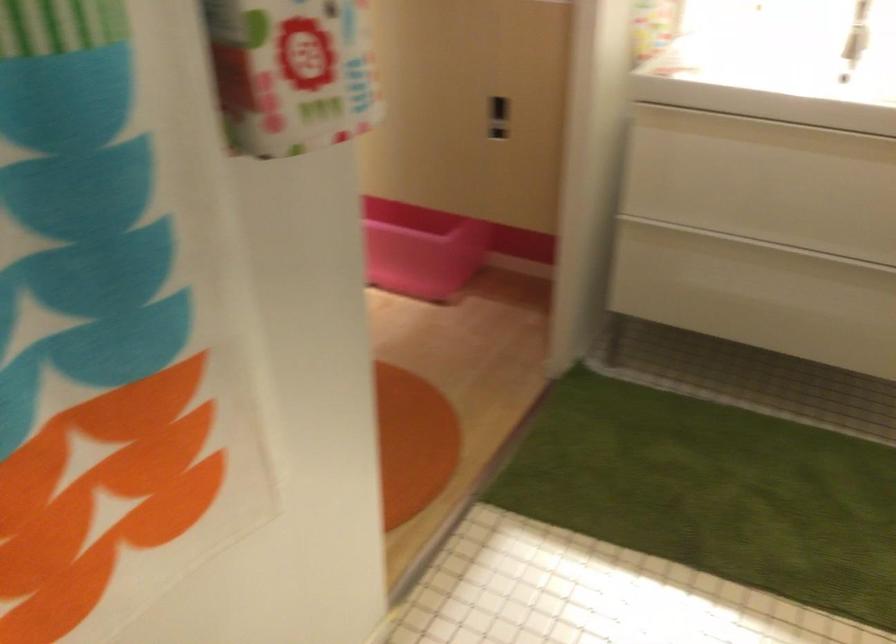
The location [420,249] corresponds to which object?

It refers to a pink plastic bin.